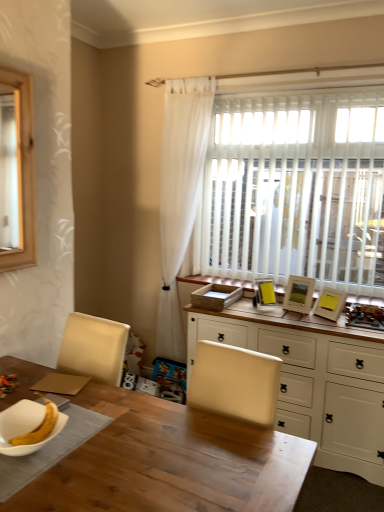
Where is `vacant space behind white glossy bowl at lower left`? vacant space behind white glossy bowl at lower left is located at coordinates (81, 408).